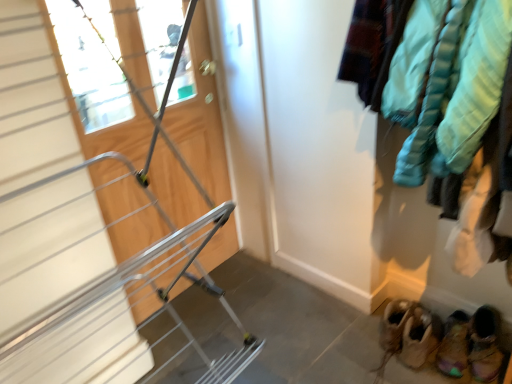
Question: From their relative heights in the image, would you say brown suede moccasins at lower right, the 1th footwear in the left-to-right sequence, is taller or shorter than multicolored suede booties at lower right, placed as the 3th footwear when sorted from left to right?

Choices:
 (A) short
 (B) tall

Answer: (A)

Question: Which is correct: brown suede moccasins at lower right, the third footwear in the right-to-left sequence, is inside multicolored suede booties at lower right, marked as the 1th footwear in a right-to-left arrangement, or outside of it?

Choices:
 (A) outside
 (B) inside

Answer: (A)

Question: Which is farther from the multicolored suede booties at lower right, placed as the 3th footwear when sorted from left to right?

Choices:
 (A) wooden door at center
 (B) leather suede booties at lower right, the 2th footwear in the right-to-left sequence
 (C) brown suede moccasins at lower right, the third footwear in the right-to-left sequence
 (D) teal puffer jacket at right

Answer: (A)

Question: Which is nearer to the multicolored suede booties at lower right, marked as the 1th footwear in a right-to-left arrangement?

Choices:
 (A) leather suede booties at lower right, the 2th footwear in the right-to-left sequence
 (B) teal puffer jacket at right
 (C) wooden door at center
 (D) brown suede moccasins at lower right, the 1th footwear in the left-to-right sequence

Answer: (A)